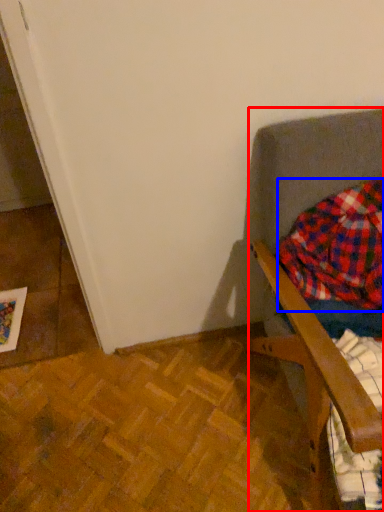
Question: Which point is further to the camera, furniture (highlighted by a red box) or flannel (highlighted by a blue box)?

Choices:
 (A) furniture
 (B) flannel

Answer: (B)